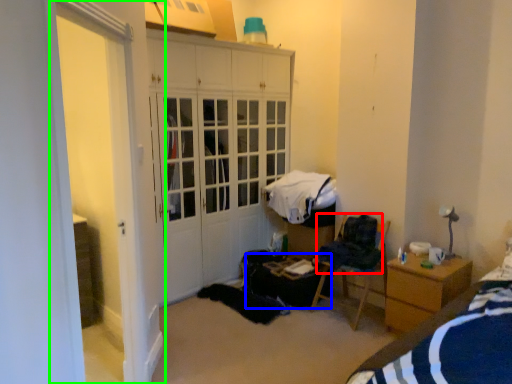
Question: Considering the real-world distances, which object is closest to clothing (highlighted by a red box)? table (highlighted by a blue box) or screen door (highlighted by a green box).

Choices:
 (A) table
 (B) screen door

Answer: (A)